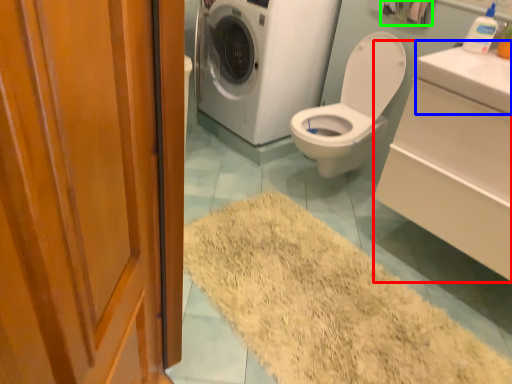
Question: Estimate the real-world distances between objects in this image. Which object is farther from counter top (highlighted by a red box), counter top (highlighted by a blue box) or toilet paper (highlighted by a green box)?

Choices:
 (A) counter top
 (B) toilet paper

Answer: (B)